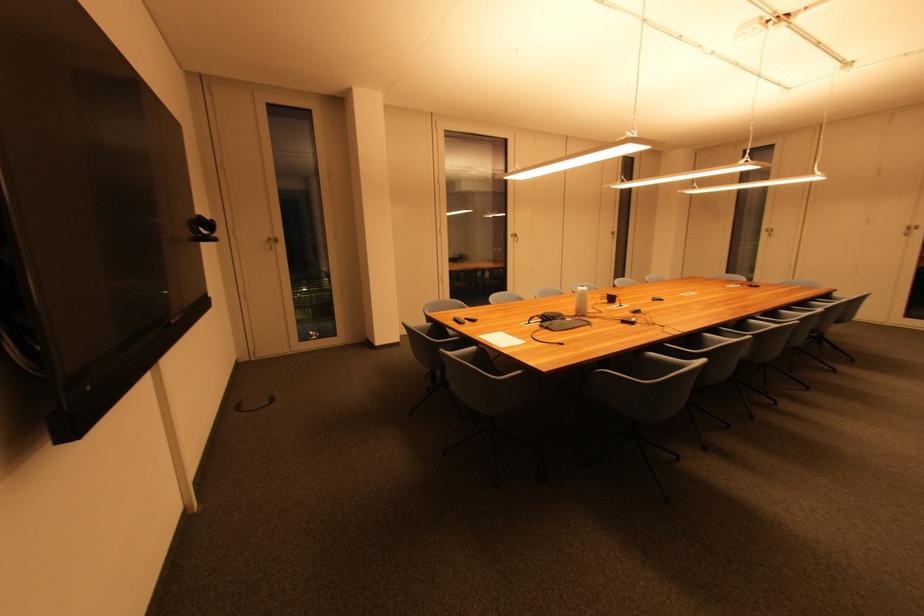
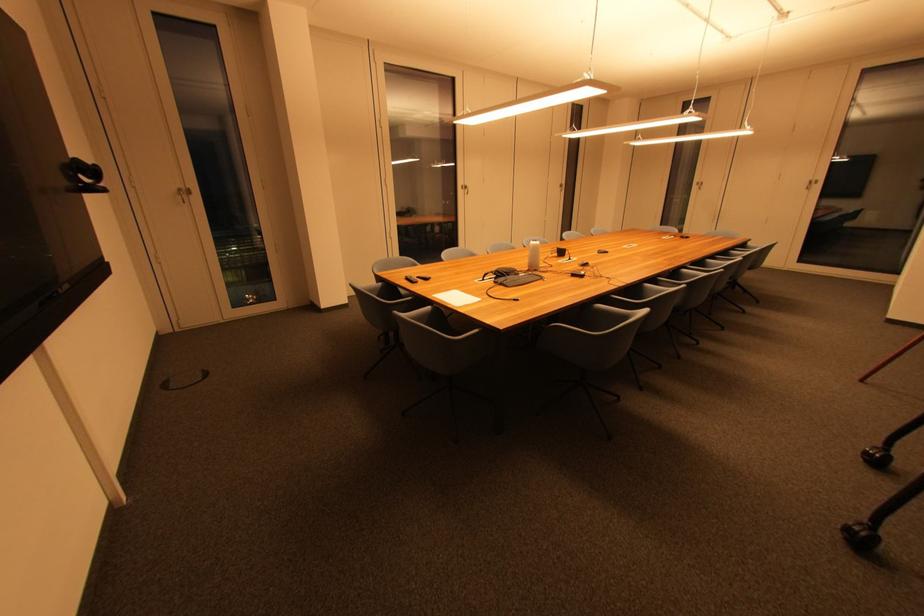
Locate, in the second image, the point that corresponds to (459,322) in the first image.

(411, 281)